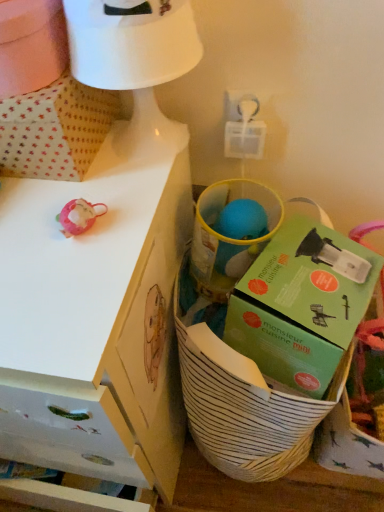
Question: Is point (152, 26) positioned closer to the camera than point (57, 123)?

Choices:
 (A) closer
 (B) farther

Answer: (A)

Question: In terms of size, does white matte table lamp at upper center appear bigger or smaller than white dotted fabric at upper left?

Choices:
 (A) big
 (B) small

Answer: (B)

Question: Considering the real-world distances, which object is closest to the white striped basket at lower right?

Choices:
 (A) white matte table lamp at upper center
 (B) white dotted fabric at upper left
 (C) white matte desk at upper left
 (D) green cardboard box at center

Answer: (D)

Question: Which object is positioned farthest from the white matte desk at upper left?

Choices:
 (A) white dotted fabric at upper left
 (B) white matte table lamp at upper center
 (C) white striped basket at lower right
 (D) green cardboard box at center

Answer: (B)